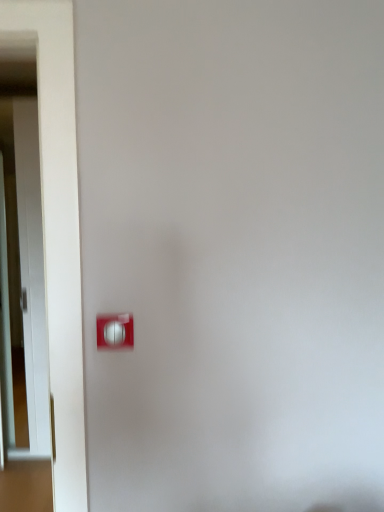
Question: Does point (31, 388) appear closer or farther from the camera than point (104, 330)?

Choices:
 (A) farther
 (B) closer

Answer: (A)

Question: From the image's perspective, is white glossy door at left located above or below white plastic light switch at lower left?

Choices:
 (A) below
 (B) above

Answer: (B)

Question: Visually, is white glossy door at left positioned to the left or to the right of white plastic light switch at lower left?

Choices:
 (A) left
 (B) right

Answer: (A)

Question: Looking at the image, does white plastic light switch at lower left seem bigger or smaller compared to white glossy door at left?

Choices:
 (A) small
 (B) big

Answer: (A)

Question: From a real-world perspective, is white plastic light switch at lower left physically located above or below white glossy door at left?

Choices:
 (A) above
 (B) below

Answer: (A)

Question: Which is correct: white plastic light switch at lower left is inside white glossy door at left, or outside of it?

Choices:
 (A) outside
 (B) inside

Answer: (A)

Question: Is point (125, 321) positioned closer to the camera than point (1, 247)?

Choices:
 (A) closer
 (B) farther

Answer: (A)